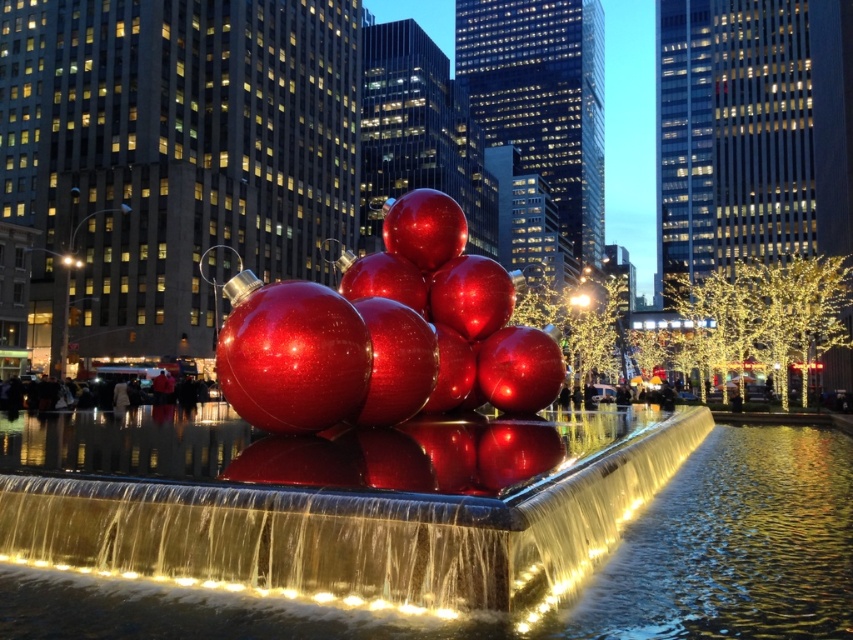
Is glossy metallic fountain at center thinner than glossy metallic water at center?

Indeed, glossy metallic fountain at center has a lesser width compared to glossy metallic water at center.

What do you see at coordinates (376, 445) in the screenshot? The width and height of the screenshot is (853, 640). I see `glossy metallic fountain at center` at bounding box center [376, 445].

This screenshot has width=853, height=640. Find the location of `glossy metallic fountain at center`. glossy metallic fountain at center is located at coordinates (376, 445).